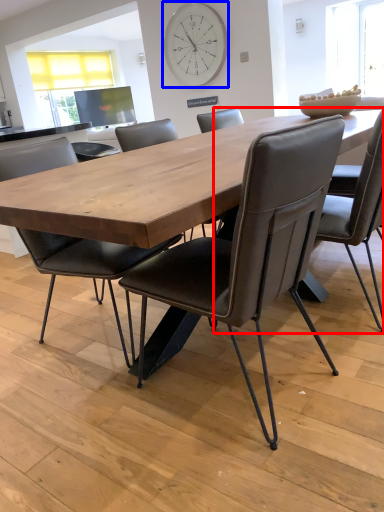
Question: Which point is further to the camera, chair (highlighted by a red box) or clock (highlighted by a blue box)?

Choices:
 (A) chair
 (B) clock

Answer: (B)